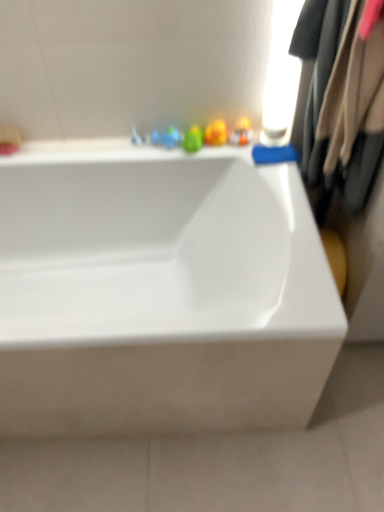
Question: Considering the relative sizes of white glossy bathtub at center and beige fabric coat at right in the image provided, is white glossy bathtub at center bigger than beige fabric coat at right?

Choices:
 (A) no
 (B) yes

Answer: (B)

Question: Is white glossy bathtub at center completely or partially outside of beige fabric coat at right?

Choices:
 (A) no
 (B) yes

Answer: (B)

Question: Can you confirm if white glossy bathtub at center is positioned to the left of beige fabric coat at right?

Choices:
 (A) no
 (B) yes

Answer: (B)

Question: Is the depth of white glossy bathtub at center greater than that of beige fabric coat at right?

Choices:
 (A) yes
 (B) no

Answer: (A)

Question: Can you confirm if white glossy bathtub at center is taller than beige fabric coat at right?

Choices:
 (A) yes
 (B) no

Answer: (A)

Question: From the image's perspective, relative to beige fabric coat at right, is white glossy bathtub at center above or below?

Choices:
 (A) above
 (B) below

Answer: (B)

Question: Considering their positions, is white glossy bathtub at center located in front of or behind beige fabric coat at right?

Choices:
 (A) front
 (B) behind

Answer: (B)

Question: In the image, is white glossy bathtub at center on the left side or the right side of beige fabric coat at right?

Choices:
 (A) left
 (B) right

Answer: (A)

Question: Would you say white glossy bathtub at center is inside or outside beige fabric coat at right?

Choices:
 (A) outside
 (B) inside

Answer: (A)

Question: From a real-world perspective, is translucent plastic toy at upper center physically located above or below beige fabric coat at right?

Choices:
 (A) above
 (B) below

Answer: (B)

Question: From their relative heights in the image, would you say translucent plastic toy at upper center is taller or shorter than beige fabric coat at right?

Choices:
 (A) tall
 (B) short

Answer: (B)

Question: In terms of size, does translucent plastic toy at upper center appear bigger or smaller than beige fabric coat at right?

Choices:
 (A) big
 (B) small

Answer: (B)

Question: Would you say translucent plastic toy at upper center is inside or outside beige fabric coat at right?

Choices:
 (A) outside
 (B) inside

Answer: (A)

Question: Is beige fabric coat at right bigger or smaller than translucent plastic toy at upper center?

Choices:
 (A) small
 (B) big

Answer: (B)

Question: From a real-world perspective, is beige fabric coat at right positioned above or below translucent plastic toy at upper center?

Choices:
 (A) below
 (B) above

Answer: (B)